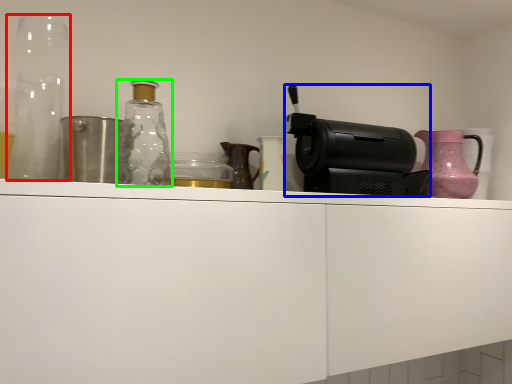
Question: Estimate the real-world distances between objects in this image. Which object is farther from glass vase (highlighted by a red box), coffee machine (highlighted by a blue box) or bottle (highlighted by a green box)?

Choices:
 (A) coffee machine
 (B) bottle

Answer: (A)